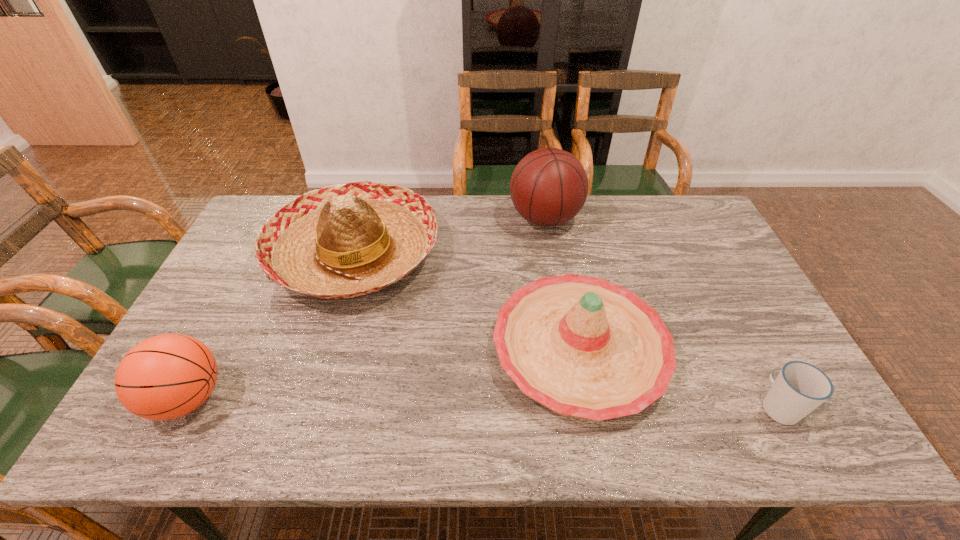
Find the location of `sombrero that is positioned at the left edge`. sombrero that is positioned at the left edge is located at coordinates (342, 241).

Where is `basketball that is at the left edge`? The height and width of the screenshot is (540, 960). basketball that is at the left edge is located at coordinates (167, 376).

The height and width of the screenshot is (540, 960). I want to click on object present at the right edge, so click(x=800, y=387).

The width and height of the screenshot is (960, 540). I want to click on object positioned at the far left corner, so click(x=342, y=241).

This screenshot has height=540, width=960. I want to click on object that is at the near left corner, so click(167, 376).

Identify the location of object that is at the near right corner. (800, 387).

Identify the location of free space at the far edge. The height and width of the screenshot is (540, 960). 472,230.

Locate an element on the screen. vacant space at the near edge of the desktop is located at coordinates [663, 447].

Identify the location of vacant space at the left edge of the desktop. (230, 274).

Where is `vacant space at the right edge`? vacant space at the right edge is located at coordinates pos(754,341).